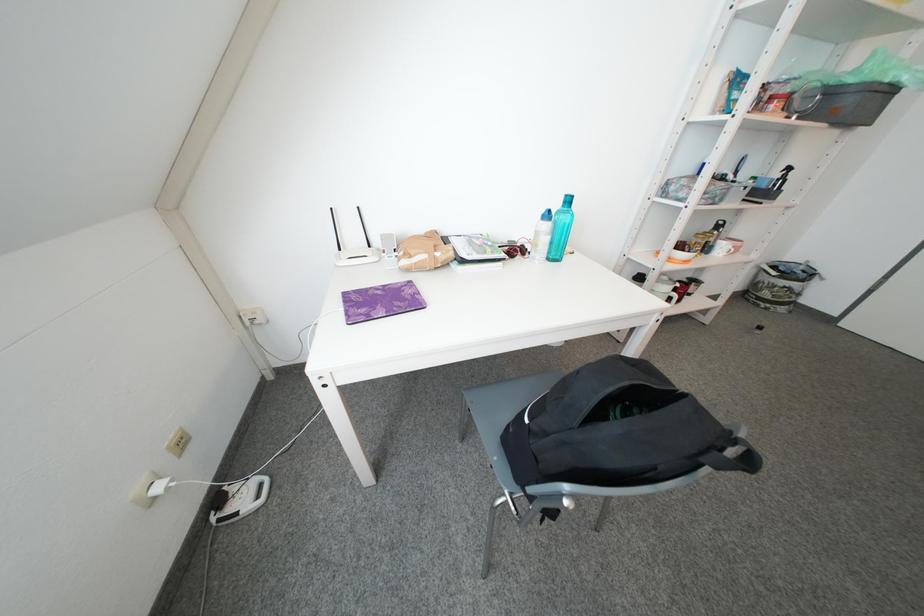
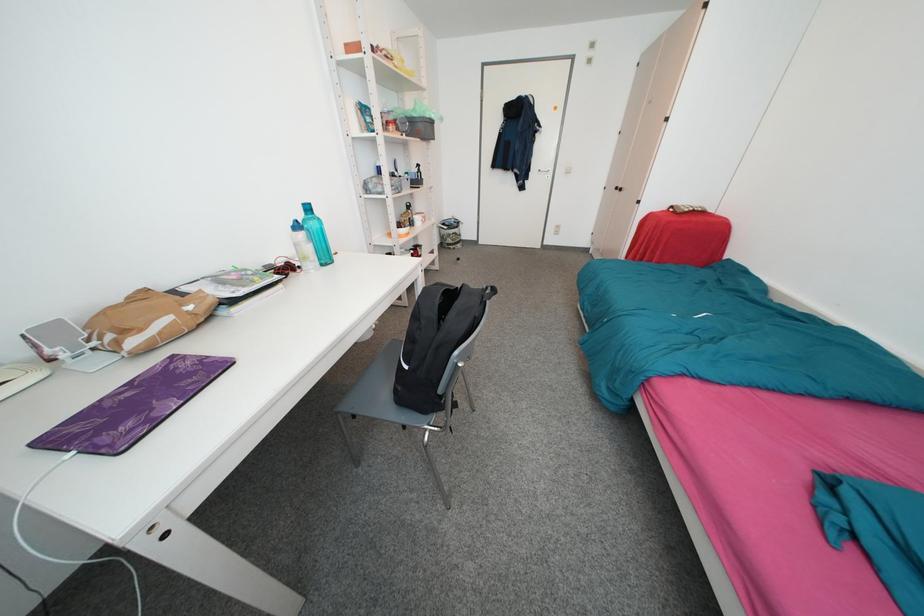
Question: The camera is either moving clockwise (left) or counter-clockwise (right) around the object. The first image is from the beginning of the video and the second image is from the end. Is the camera moving left or right when shooting the video?

Choices:
 (A) Left
 (B) Right

Answer: (A)